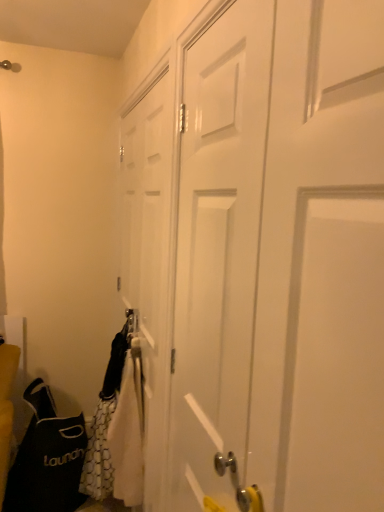
Question: Is black fabric laundry bag at lower left to the left or to the right of white matte door at center, the first door viewed from the back, in the image?

Choices:
 (A) right
 (B) left

Answer: (B)

Question: From a real-world perspective, relative to white matte door at center, the first door viewed from the back, is black fabric laundry bag at lower left vertically above or below?

Choices:
 (A) above
 (B) below

Answer: (B)

Question: Considering the real-world distances, which object is closest to the white matte door at center, which is counted as the first door, starting from the front?

Choices:
 (A) white matte door at center, which appears as the second door when viewed from the front
 (B) black fabric laundry bag at lower left

Answer: (A)

Question: Considering the real-world distances, which object is farthest from the white matte door at center, which appears as the second door when viewed from the front?

Choices:
 (A) white matte door at center, which is counted as the first door, starting from the front
 (B) black fabric laundry bag at lower left

Answer: (B)